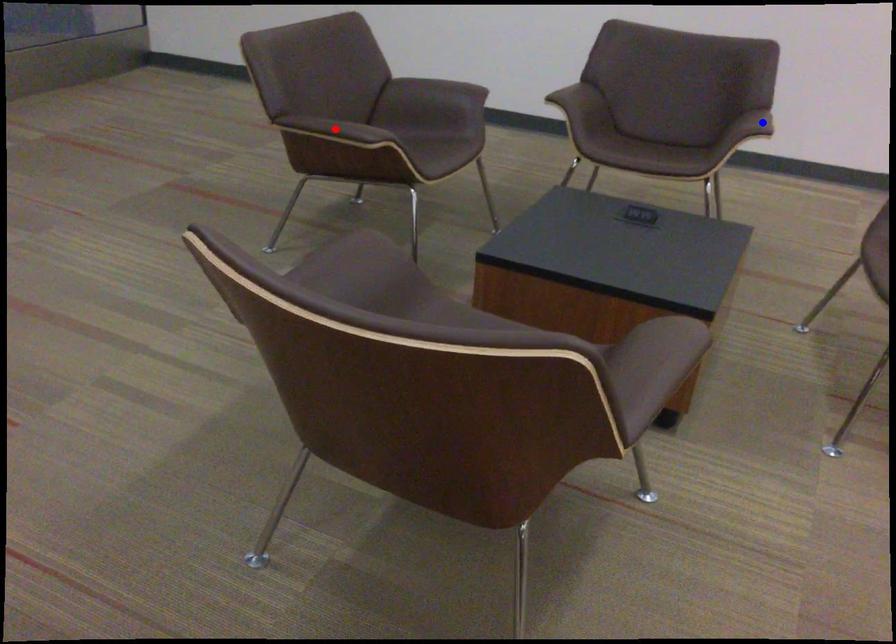
Question: In the image, two points are highlighted. Which point is nearer to the camera? Reply with the corresponding letter.

Choices:
 (A) blue point
 (B) red point

Answer: (B)